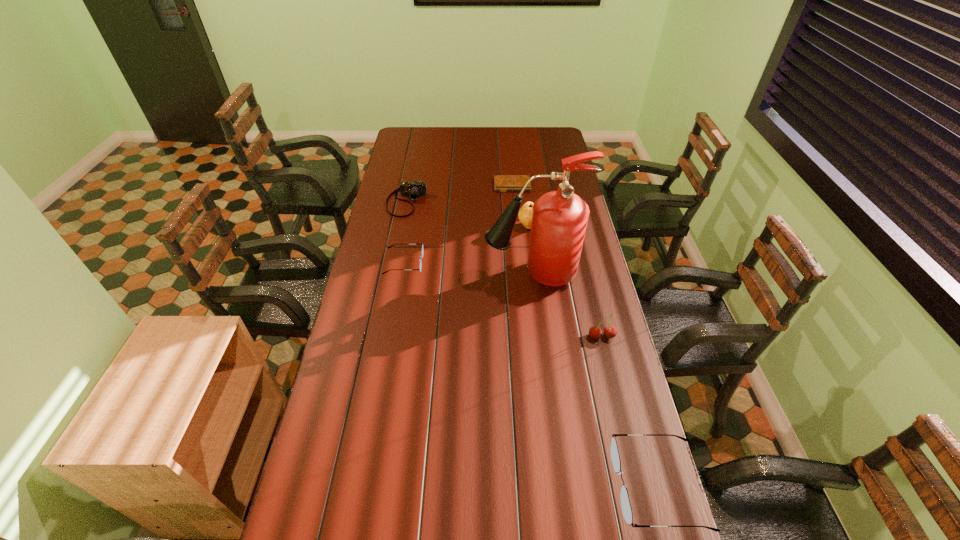
Where is `the shorter spectacles`? This screenshot has width=960, height=540. the shorter spectacles is located at coordinates (422, 251).

In order to click on the left spectacles in this screenshot , I will do `click(422, 251)`.

I want to click on the nearer spectacles, so click(x=615, y=457).

Where is `the nearest object`? The height and width of the screenshot is (540, 960). the nearest object is located at coordinates (615, 457).

What are the coordinates of `pear` in the screenshot? It's located at (525, 213).

Where is `camera`? camera is located at coordinates (414, 189).

What are the coordinates of `diary` in the screenshot? It's located at (502, 183).

In order to click on the tallest object in this screenshot , I will do `click(559, 219)`.

The image size is (960, 540). In order to click on cherry in this screenshot , I will do `click(610, 331)`.

The image size is (960, 540). In order to click on vacant area located 0.200m on the lenses of the left spectacles in this screenshot , I will do `click(474, 263)`.